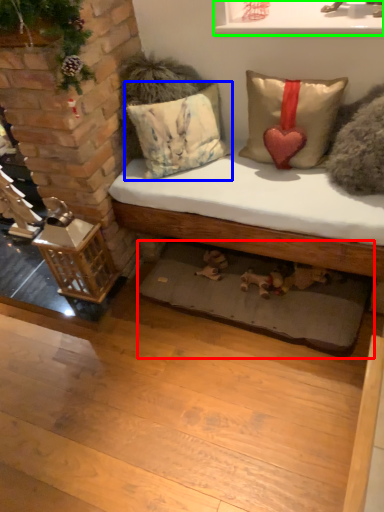
Question: Which object is the farthest from mat (highlighted by a red box)? Choose among these: pillow (highlighted by a blue box) or window sill (highlighted by a green box).

Choices:
 (A) pillow
 (B) window sill

Answer: (B)